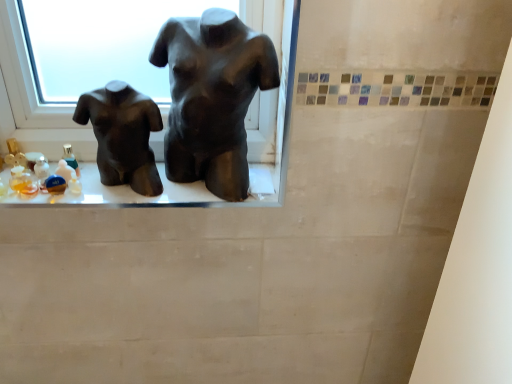
Question: Considering the relative sizes of matte black torso at center, the 2th statue (sculpture) from the left, and matte black torso at left, which ranks as the 2th statue (sculpture) in right-to-left order, in the image provided, is matte black torso at center, the 2th statue (sculpture) from the left, shorter than matte black torso at left, which ranks as the 2th statue (sculpture) in right-to-left order,?

Choices:
 (A) yes
 (B) no

Answer: (B)

Question: Can you confirm if matte black torso at center, the 2th statue (sculpture) from the left, is taller than matte black torso at left, which appears as the first statue (sculpture) when viewed from the left?

Choices:
 (A) yes
 (B) no

Answer: (A)

Question: Does matte black torso at center, which is the 1th statue (sculpture) in right-to-left order, touch matte black torso at left, which ranks as the 2th statue (sculpture) in right-to-left order?

Choices:
 (A) no
 (B) yes

Answer: (A)

Question: Is matte black torso at center, which is the 1th statue (sculpture) in right-to-left order, smaller than matte black torso at left, which ranks as the 2th statue (sculpture) in right-to-left order?

Choices:
 (A) no
 (B) yes

Answer: (A)

Question: Can you confirm if matte black torso at center, which is the 1th statue (sculpture) in right-to-left order, is bigger than matte black torso at left, which appears as the first statue (sculpture) when viewed from the left?

Choices:
 (A) yes
 (B) no

Answer: (A)

Question: Would you consider matte black torso at center, the 2th statue (sculpture) from the left, to be distant from matte black torso at left, which ranks as the 2th statue (sculpture) in right-to-left order?

Choices:
 (A) no
 (B) yes

Answer: (A)

Question: Is matte black torso at left, which appears as the first statue (sculpture) when viewed from the left, located within matte black mannequin torso at center?

Choices:
 (A) yes
 (B) no

Answer: (B)

Question: Considering the relative positions of matte black mannequin torso at center and matte black torso at left, which ranks as the 2th statue (sculpture) in right-to-left order, in the image provided, is matte black mannequin torso at center behind matte black torso at left, which ranks as the 2th statue (sculpture) in right-to-left order,?

Choices:
 (A) yes
 (B) no

Answer: (A)

Question: Is matte black mannequin torso at center positioned beyond the bounds of matte black torso at left, which ranks as the 2th statue (sculpture) in right-to-left order?

Choices:
 (A) no
 (B) yes

Answer: (B)

Question: Can you confirm if matte black mannequin torso at center is positioned to the right of matte black torso at left, which appears as the first statue (sculpture) when viewed from the left?

Choices:
 (A) yes
 (B) no

Answer: (A)

Question: Is matte black mannequin torso at center facing towards matte black torso at left, which appears as the first statue (sculpture) when viewed from the left?

Choices:
 (A) no
 (B) yes

Answer: (A)

Question: Is matte black mannequin torso at center at the left side of matte black torso at left, which appears as the first statue (sculpture) when viewed from the left?

Choices:
 (A) no
 (B) yes

Answer: (A)

Question: Is matte black mannequin torso at center taller than matte black torso at center, the 2th statue (sculpture) from the left?

Choices:
 (A) yes
 (B) no

Answer: (B)